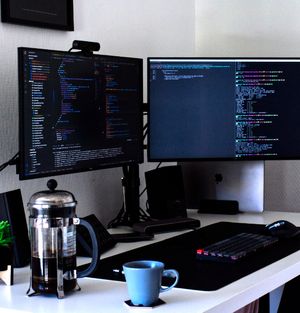
This screenshot has height=313, width=300. In order to click on keyboard in this screenshot , I will do `click(229, 252)`.